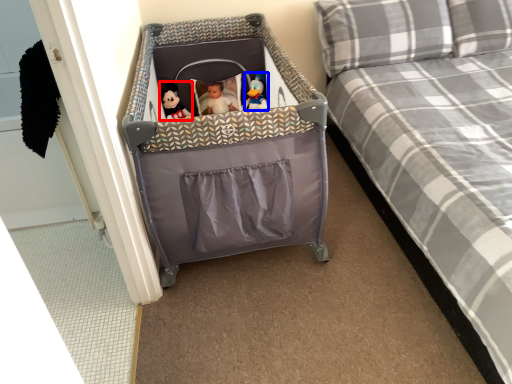
Question: Which of the following is the closest to the observer, doll (highlighted by a red box) or toy (highlighted by a blue box)?

Choices:
 (A) doll
 (B) toy

Answer: (B)